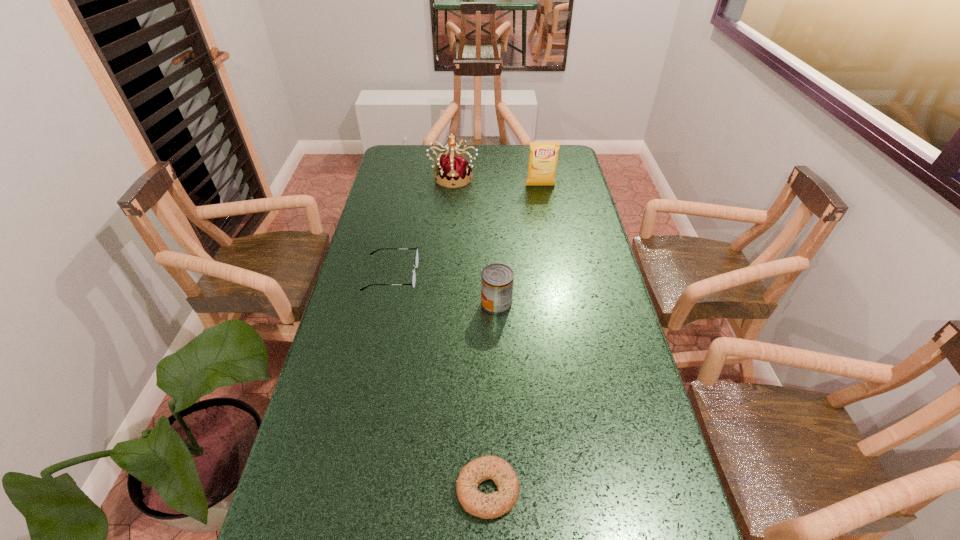
The image size is (960, 540). I want to click on free spot located on the back of the shortest object, so click(x=487, y=401).

Find the location of a particular element. object at the far edge is located at coordinates (454, 169).

Where is `object located at the left edge`? object located at the left edge is located at coordinates (416, 256).

Where is `object located in the right edge section of the desktop`? This screenshot has width=960, height=540. object located in the right edge section of the desktop is located at coordinates (543, 157).

In the image, there is a desktop. At what (x,y) coordinates should I click in order to perform the action: click on vacant space at the far edge. Please return your answer as a coordinate pair (x, y). Looking at the image, I should click on (522, 167).

At what (x,y) coordinates should I click in order to perform the action: click on free region at the left edge. Please return your answer as a coordinate pair (x, y). Looking at the image, I should click on (336, 484).

Locate an element on the screen. The height and width of the screenshot is (540, 960). vacant space at the right edge is located at coordinates (595, 299).

Image resolution: width=960 pixels, height=540 pixels. I want to click on blank space at the far left corner of the desktop, so 398,170.

Image resolution: width=960 pixels, height=540 pixels. Find the location of `free spot between the nearest object and the third shortest object`. free spot between the nearest object and the third shortest object is located at coordinates click(492, 396).

At what (x,y) coordinates should I click in order to perform the action: click on vacant area that lies between the crisp (potato chip) and the can. Please return your answer as a coordinate pair (x, y). Looking at the image, I should click on (518, 245).